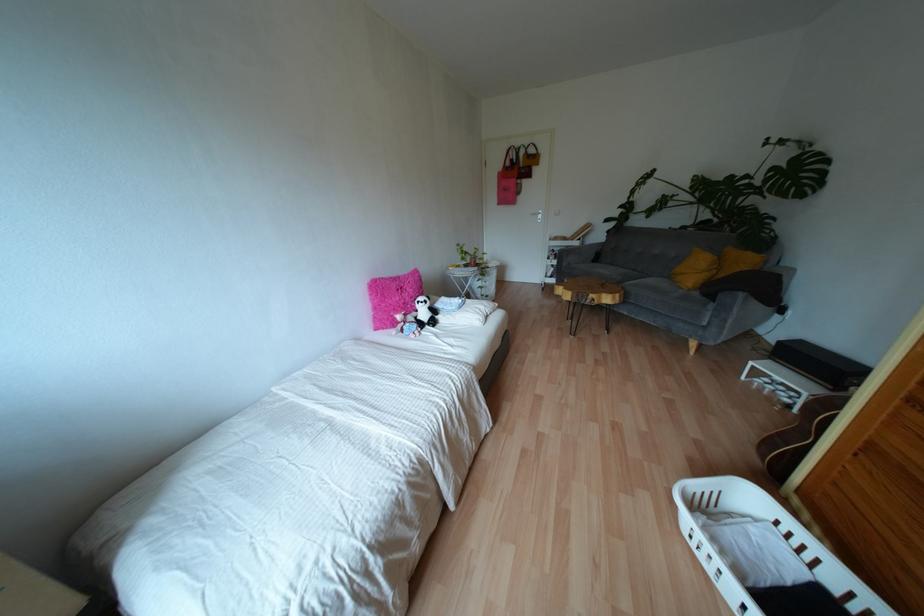
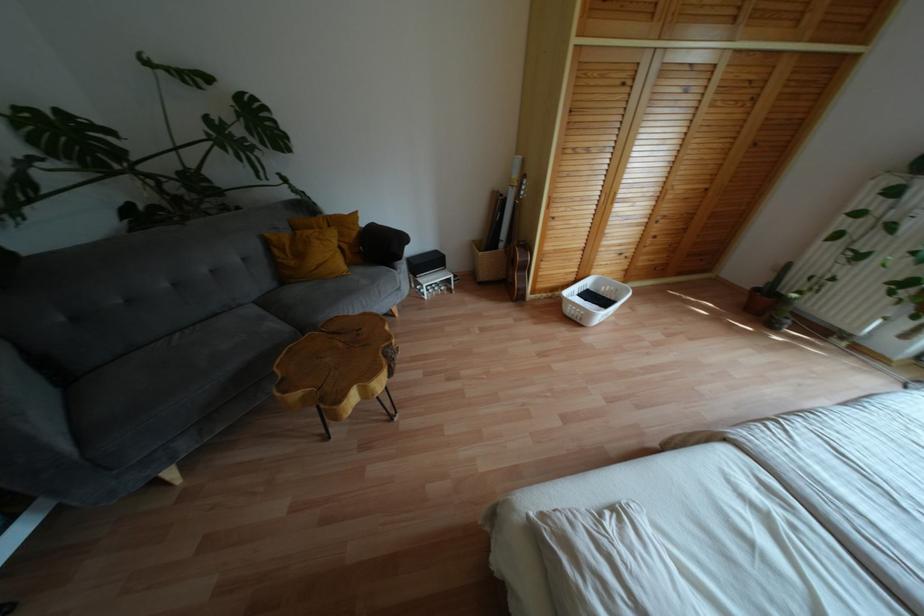
Find the pixel in the second image that matches [819,153] in the first image.

(253, 98)